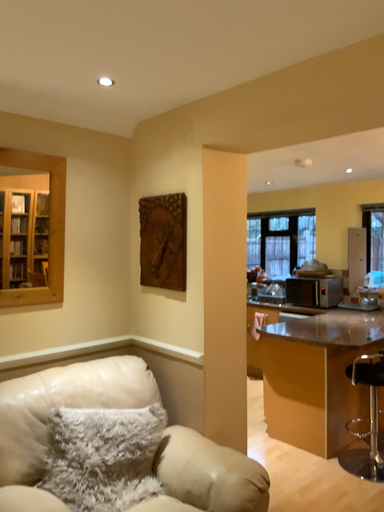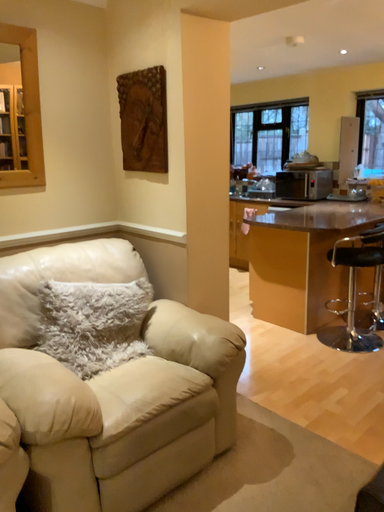
Question: Which way did the camera rotate in the video?

Choices:
 (A) rotated upward
 (B) rotated downward

Answer: (B)